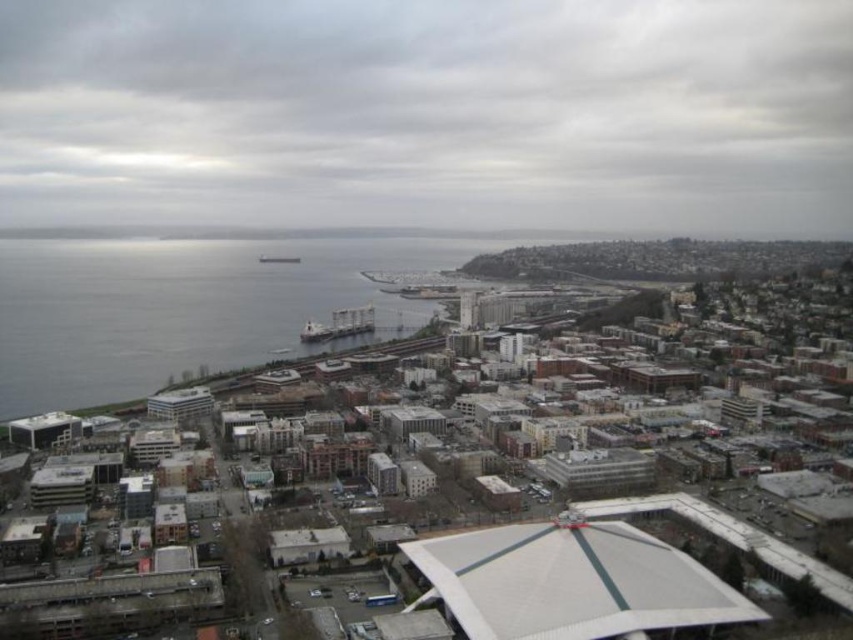
Does gray cloudy sky at upper center appear on the right side of gray water at left?

Yes, gray cloudy sky at upper center is to the right of gray water at left.

Does gray cloudy sky at upper center have a larger size compared to gray water at left?

Result: Yes.

Is point (401, 72) positioned in front of point (115, 300)?

No, (401, 72) is further to viewer.

Identify the location of gray cloudy sky at upper center. This screenshot has width=853, height=640. (428, 113).